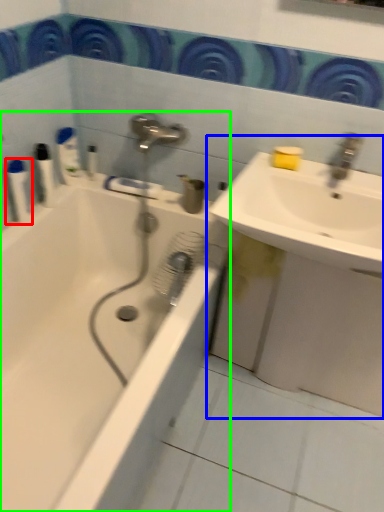
Question: Which object is positioned farthest from toiletry (highlighted by a red box)? Select from sink (highlighted by a blue box) and bathtub (highlighted by a green box).

Choices:
 (A) sink
 (B) bathtub

Answer: (A)